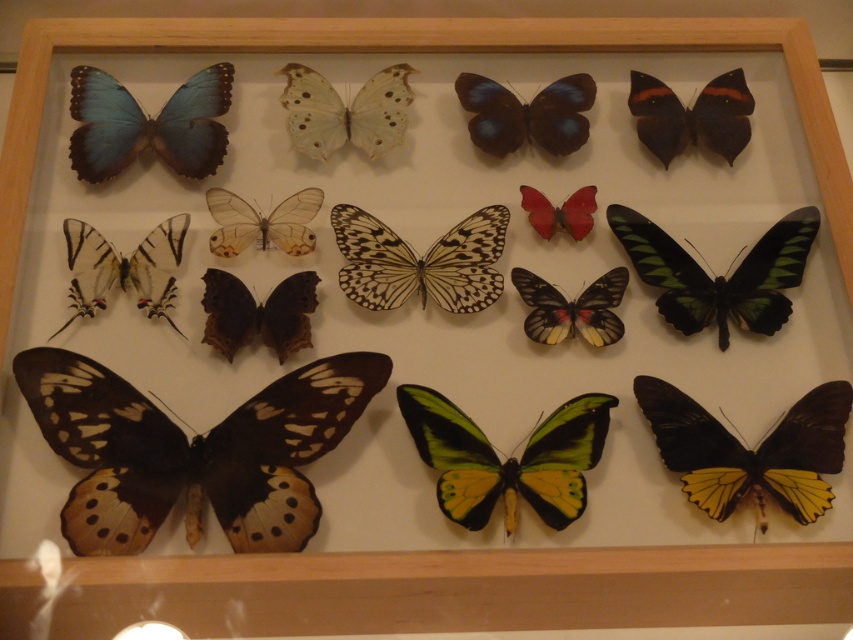
Does brown matte butterfly at lower left have a smaller size compared to matte red butterfly at center-right?

Actually, brown matte butterfly at lower left might be larger than matte red butterfly at center-right.

Can you confirm if brown matte butterfly at lower left is positioned to the left of matte red butterfly at center-right?

Correct, you'll find brown matte butterfly at lower left to the left of matte red butterfly at center-right.

Does point (210, 449) lie behind point (558, 221)?

That is False.

The height and width of the screenshot is (640, 853). In order to click on brown matte butterfly at lower left in this screenshot , I will do `click(192, 449)`.

Can you confirm if translucent white butterfly at center is taller than matte red butterfly at center-right?

Yes.

Is translucent white butterfly at center shorter than matte red butterfly at center-right?

No.

The height and width of the screenshot is (640, 853). In order to click on translucent white butterfly at center in this screenshot , I will do `click(345, 112)`.

The height and width of the screenshot is (640, 853). Find the location of `translucent white butterfly at center`. translucent white butterfly at center is located at coordinates (345, 112).

Does green glossy butterfly at center right have a smaller size compared to white paper-like wings at center?

No, green glossy butterfly at center right is not smaller than white paper-like wings at center.

Which is behind, point (695, 321) or point (492, 285)?

Point (492, 285)

Identify the location of green glossy butterfly at center right. (718, 275).